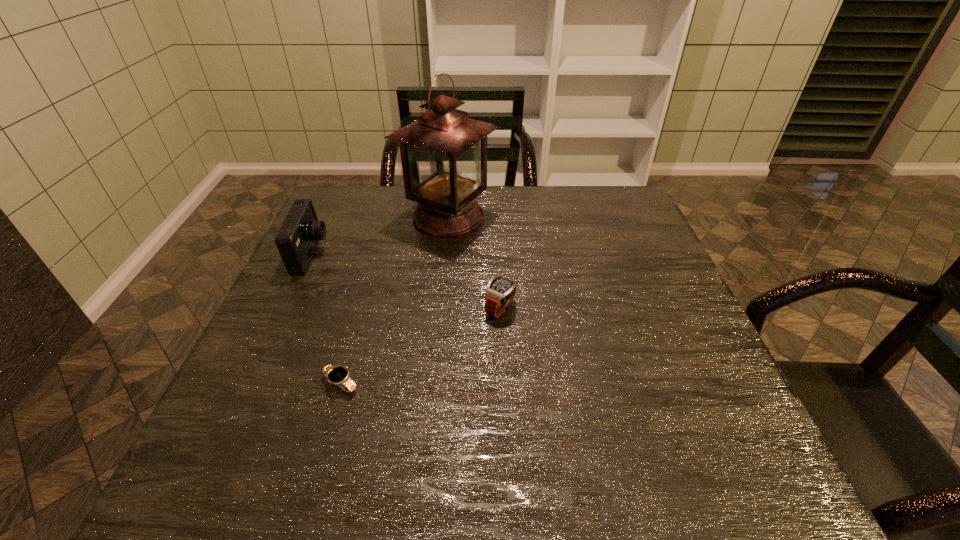
This screenshot has width=960, height=540. In order to click on vacant space that satisfies the following two spatial constraints: 1. on the back side of the right watch; 2. on the front-facing side of the leftmost object in this screenshot , I will do `click(498, 255)`.

Identify the location of free space that satisfies the following two spatial constraints: 1. on the front side of the oil lamp; 2. on the front-facing side of the camera. (444, 255).

Locate an element on the screen. free space that satisfies the following two spatial constraints: 1. on the front-facing side of the nearer watch; 2. on the right side of the leftmost object is located at coordinates (252, 383).

Where is `free location that satisfies the following two spatial constraints: 1. on the front side of the tallest object; 2. on the front-facing side of the camera`? This screenshot has width=960, height=540. free location that satisfies the following two spatial constraints: 1. on the front side of the tallest object; 2. on the front-facing side of the camera is located at coordinates (444, 255).

The height and width of the screenshot is (540, 960). What are the coordinates of `vacant area that satisfies the following two spatial constraints: 1. on the front-facing side of the leftmost object; 2. on the right side of the taller watch` in the screenshot? It's located at (286, 309).

This screenshot has height=540, width=960. Find the location of `vacant area that satisfies the following two spatial constraints: 1. on the front side of the oil lamp; 2. on the front-facing side of the leftmost object`. vacant area that satisfies the following two spatial constraints: 1. on the front side of the oil lamp; 2. on the front-facing side of the leftmost object is located at coordinates (444, 255).